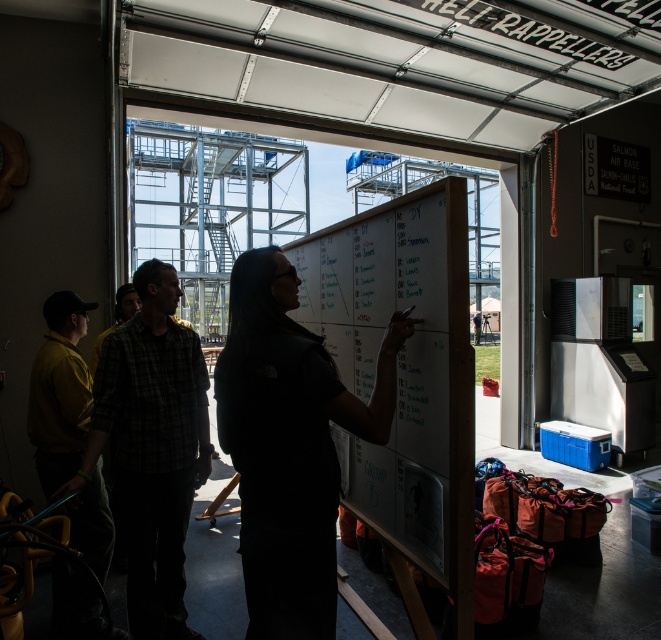
Is whiteboard at center wider than yellow matte shirt at left?

Correct, the width of whiteboard at center exceeds that of yellow matte shirt at left.

Who is lower down, whiteboard at center or yellow matte shirt at left?

yellow matte shirt at left is below.

What do you see at coordinates (403, 371) in the screenshot? I see `whiteboard at center` at bounding box center [403, 371].

Identify the location of whiteboard at center. This screenshot has width=661, height=640. (403, 371).

Can you confirm if whiteboard at center is thinner than plaid shirt at center?

No.

Which of these two, whiteboard at center or plaid shirt at center, stands taller?

whiteboard at center

Describe the element at coordinates (403, 371) in the screenshot. I see `whiteboard at center` at that location.

Locate an element on the screen. whiteboard at center is located at coordinates (403, 371).

Is black matte shirt at center positioned at the back of plaid fabric shirt at center?

No, it is not.

Can you confirm if black matte shirt at center is positioned to the left of plaid fabric shirt at center?

In fact, black matte shirt at center is to the right of plaid fabric shirt at center.

Between point (276, 522) and point (93, 420), which one is positioned behind?

The point (93, 420) is behind.

Image resolution: width=661 pixels, height=640 pixels. What are the coordinates of `black matte shirt at center` in the screenshot? It's located at (288, 445).